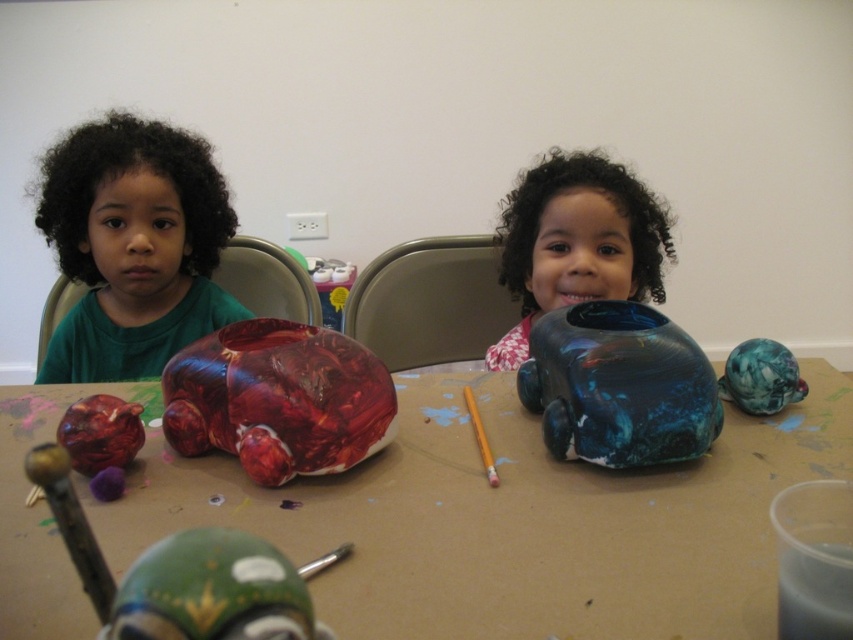
Who is positioned more to the right, shiny plastic car at center or blue glossy vase at center?

Positioned to the right is blue glossy vase at center.

Does shiny plastic car at center have a larger size compared to blue glossy vase at center?

Correct, shiny plastic car at center is larger in size than blue glossy vase at center.

Who is more distant from viewer, (701,460) or (618,248)?

The point (618,248) is more distant.

Where is `shiny plastic car at center`? shiny plastic car at center is located at coordinates pos(514,522).

Does matte green shirt at left appear on the left side of glossy ceramic car at center?

Yes, matte green shirt at left is to the left of glossy ceramic car at center.

Who is shorter, matte green shirt at left or glossy ceramic car at center?

glossy ceramic car at center

Who is more forward, (215, 237) or (692, 422)?

Point (692, 422) is more forward.

The image size is (853, 640). I want to click on matte green shirt at left, so click(x=132, y=246).

Which is below, matte green shirt at left or blue glossy vase at center?

blue glossy vase at center is lower down.

Is point (177, 262) positioned after point (532, 180)?

Yes, it is.

The height and width of the screenshot is (640, 853). What do you see at coordinates (132, 246) in the screenshot?
I see `matte green shirt at left` at bounding box center [132, 246].

This screenshot has width=853, height=640. I want to click on matte green shirt at left, so click(132, 246).